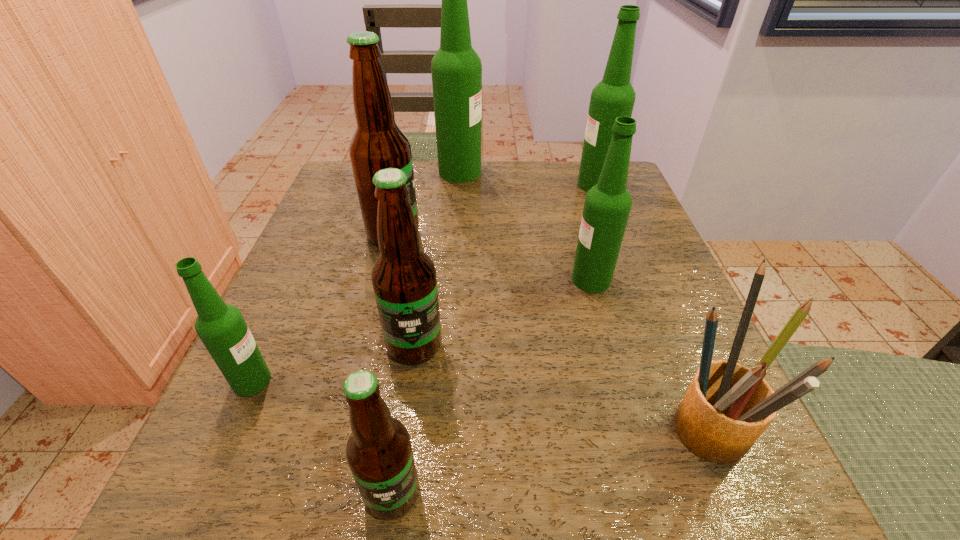
Image resolution: width=960 pixels, height=540 pixels. In order to click on free space located on the label of the second nearest green beer bottle in this screenshot , I will do `click(424, 280)`.

Locate an element on the screen. vacant area situated 0.190m on the label of the second smallest brown beer bottle is located at coordinates (393, 500).

Locate an element on the screen. vacant point located 0.360m on the back of the pencil box is located at coordinates (622, 231).

At what (x,y) coordinates should I click in order to perform the action: click on vacant area situated on the label of the smallest green beer bottle. Please return your answer as a coordinate pair (x, y). This screenshot has height=540, width=960. Looking at the image, I should click on (510, 381).

In order to click on pencil box at the near edge in this screenshot , I will do click(x=726, y=408).

Where is `beer bottle that is at the near edge`? beer bottle that is at the near edge is located at coordinates (379, 453).

This screenshot has height=540, width=960. Identify the location of pencil box that is at the right edge. (726, 408).

Where is `object located at the far right corner`? The height and width of the screenshot is (540, 960). object located at the far right corner is located at coordinates (x=614, y=96).

Find the location of a particular element. object present at the near right corner is located at coordinates (726, 408).

Where is `vacant region at the far edge`? This screenshot has height=540, width=960. vacant region at the far edge is located at coordinates (494, 167).